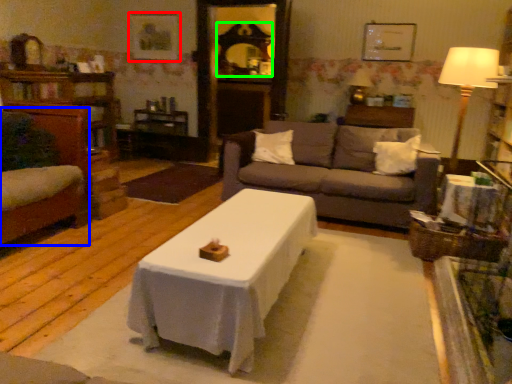
Question: Estimate the real-world distances between objects in this image. Which object is farther from picture frame (highlighted by a red box), swivel chair (highlighted by a blue box) or mirror (highlighted by a green box)?

Choices:
 (A) swivel chair
 (B) mirror

Answer: (A)